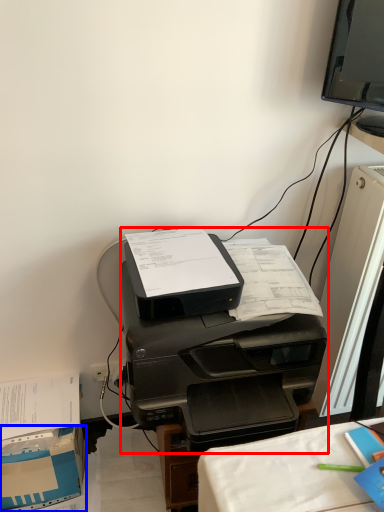
Question: Which point is further to the camera, printer (highlighted by a red box) or cardboard box (highlighted by a blue box)?

Choices:
 (A) printer
 (B) cardboard box

Answer: (B)